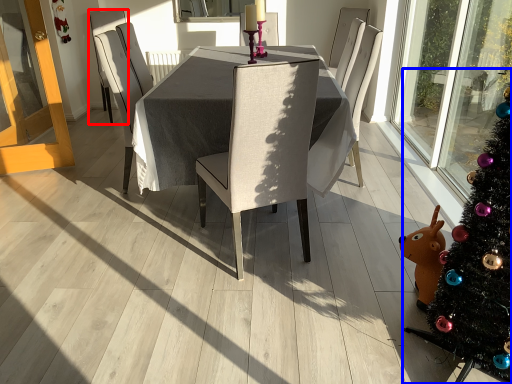
Question: Which point is closer to the camera, chair (highlighted by a red box) or christmas tree (highlighted by a blue box)?

Choices:
 (A) chair
 (B) christmas tree

Answer: (B)